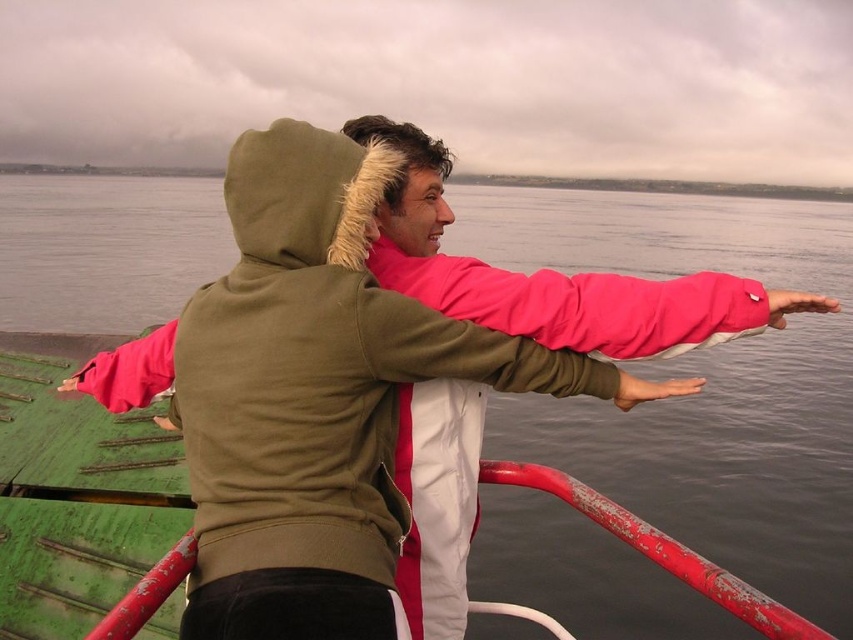
You are on a boat and want to lean against the rusty metal rail at lower right while looking at the green matte water at center. Is the rail accessible from your current position without moving past the water?

The rusty metal rail at lower right is behind the green matte water at center, so you would need to move past the water to reach it, making it inaccessible from your current position.

You are a safety inspector on the boat and need to ensure the distance between the green matte water at center and the rusty metal rail at lower right is sufficient to prevent accidents. According to the image, which object is positioned higher and could pose a safety risk if someone steps over it?

The green matte water at center is located above the rusty metal rail at lower right. This means the water is higher than the rail, so if someone steps over the rail towards the water, they might accidentally step into the water, posing a safety risk.